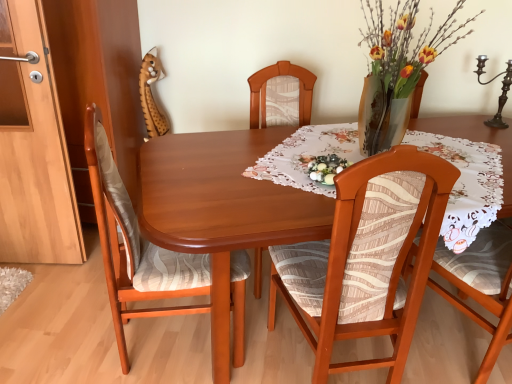
In order to click on vacant area situated below wooden chair at left, arranged as the first chair when viewed from the left (from a real-world perspective) in this screenshot , I will do `click(174, 345)`.